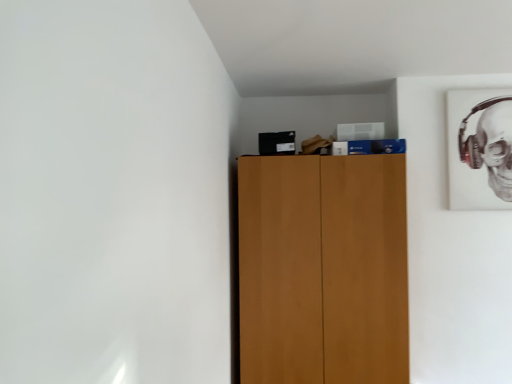
What do you see at coordinates (480, 149) in the screenshot?
I see `black matte picture frame at upper right` at bounding box center [480, 149].

Identify the location of black matte picture frame at upper right. (480, 149).

Measure the distance between black matte picture frame at upper right and camera.

8.80 feet.

The height and width of the screenshot is (384, 512). I want to click on black matte picture frame at upper right, so click(480, 149).